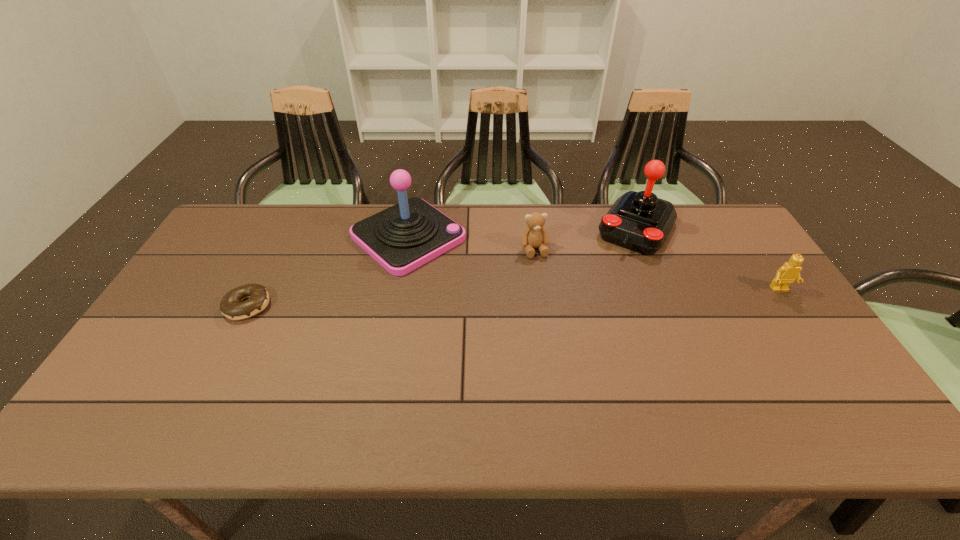
Find the location of a particular element. empty space between the Lego and the shortest object is located at coordinates (514, 298).

Identify the location of empty location between the shortest object and the rightmost object. (514, 298).

At what (x,y) coordinates should I click in order to perform the action: click on free space between the Lego and the left joystick. Please return your answer as a coordinate pair (x, y). Image resolution: width=960 pixels, height=540 pixels. Looking at the image, I should click on (594, 263).

Find the location of `vacant point located between the rightmost object and the left joystick`. vacant point located between the rightmost object and the left joystick is located at coordinates point(594,263).

Locate an element on the screen. This screenshot has width=960, height=540. unoccupied area between the doughnut and the teddy bear is located at coordinates (391, 278).

Identify the location of vacant area that lies between the fourth object from right to left and the second object from right to left. (522, 233).

The image size is (960, 540). I want to click on the second closest object to the teddy bear, so click(x=403, y=237).

Where is `object that stands as the second closest to the leftmost object`? object that stands as the second closest to the leftmost object is located at coordinates (534, 236).

Locate an element on the screen. The height and width of the screenshot is (540, 960). vacant region that satisfies the following two spatial constraints: 1. on the back side of the shortest object; 2. on the left side of the teddy bear is located at coordinates (276, 249).